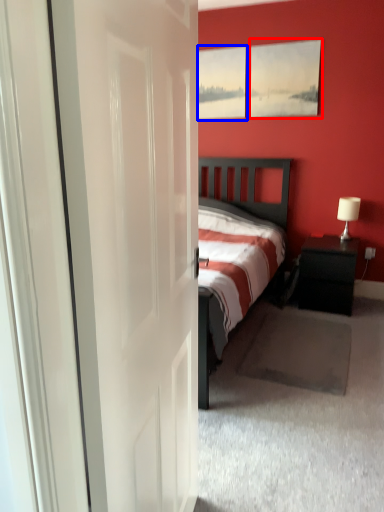
Question: Which of the following is the farthest to the observer, picture frame (highlighted by a red box) or window (highlighted by a blue box)?

Choices:
 (A) picture frame
 (B) window

Answer: (B)